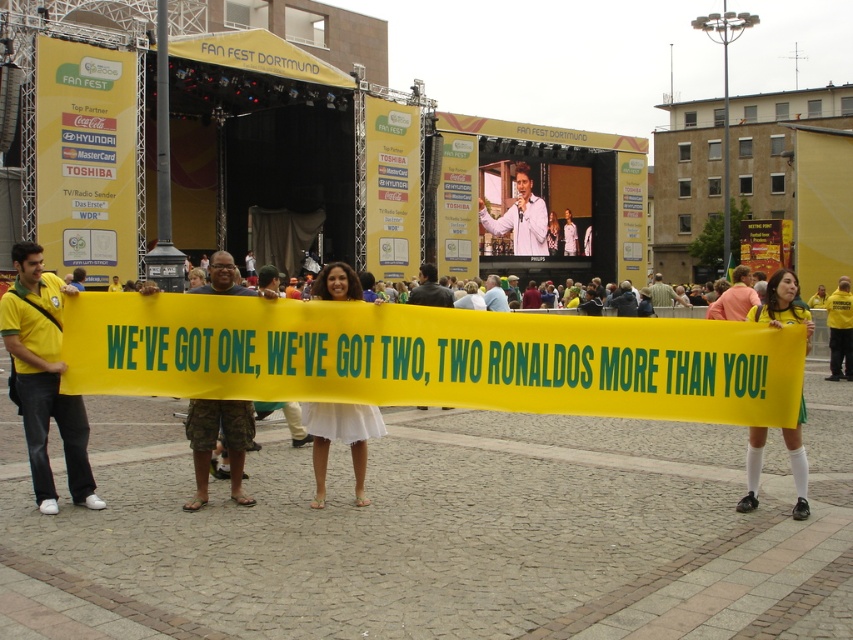
You are a photographer at the event and need to capture both the camouflage shorts at center and the white fabric dress at center in a single shot. What is the minimum distance you need to step back to ensure both objects are in frame?

The camouflage shorts at center and white fabric dress at center are 3.46 feet apart. To capture both in a single shot, you need to step back at least 3.46 feet to ensure the camera can frame both objects.

You are a photographer at the event and want to take a picture of the yellow shirt at center without the white socks at lower right appearing in the frame. Is this possible based on their positions?

The white socks at lower right is below the yellow shirt at center, so if you position the camera to focus on the upper part of the yellow shirt at center and avoid the lower area, it should be possible to exclude the white socks at lower right from the frame.

What is located at the coordinates point [213,442] in the image?

The point [213,442] indicates camouflage shorts at center.